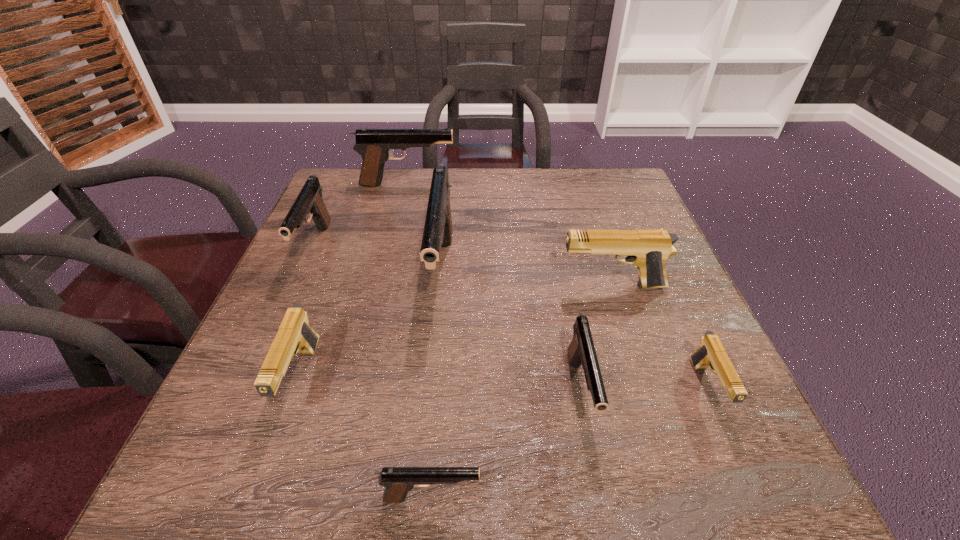
Identify which black pistol is the third closest to the leftmost pistol. Please provide its 2D coordinates. Your answer should be formatted as a tuple, i.e. [(x, y)], where the tuple contains the x and y coordinates of a point satisfying the conditions above.

[(398, 481)]

Where is `the third closest black pistol to the farthest black pistol`? the third closest black pistol to the farthest black pistol is located at coordinates (581, 350).

Select which tan pistol appears as the second closest to the biggest tan pistol. Please provide its 2D coordinates. Your answer should be formatted as a tuple, i.e. [(x, y)], where the tuple contains the x and y coordinates of a point satisfying the conditions above.

[(295, 335)]

I want to click on tan pistol that is the third closest to the leftmost pistol, so click(x=711, y=353).

Identify the location of vacant space that satisfies the following two spatial constraints: 1. at the muzzle of the rightmost black pistol; 2. at the muzzle of the nearest black pistol. (602, 497).